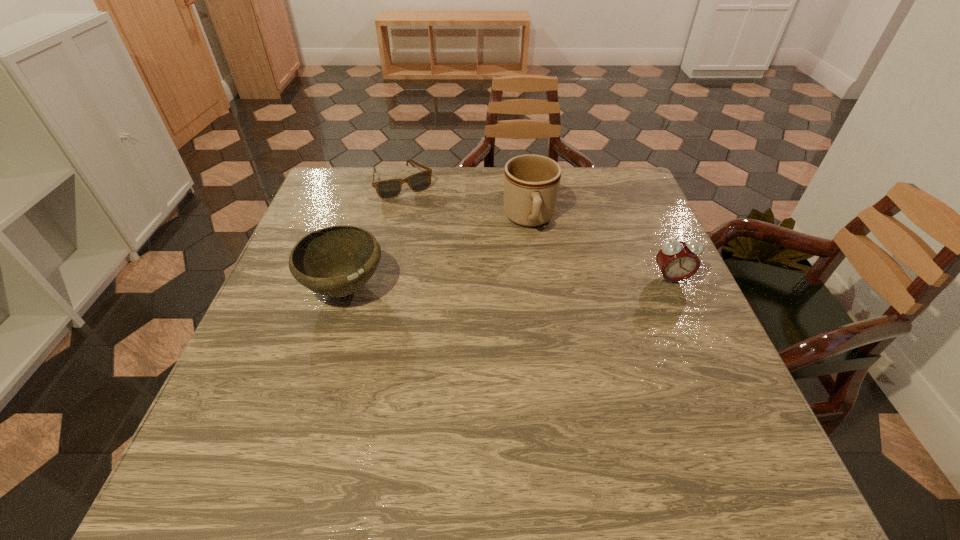
In the image, there is a desktop. Identify the location of vacant space at the left edge. (278, 278).

This screenshot has width=960, height=540. Identify the location of free spot at the right edge of the desktop. (615, 245).

The image size is (960, 540). I want to click on vacant region at the far left corner of the desktop, so click(364, 170).

What are the coordinates of `free location at the near left corner of the desktop` in the screenshot? It's located at (255, 417).

You are a GUI agent. You are given a task and a screenshot of the screen. Output one action in this format:
    pyautogui.click(x=<x>, y=<y>)
    Task: Click on the free space at the far right corner
    This screenshot has height=540, width=960.
    Given the screenshot: What is the action you would take?
    pyautogui.click(x=595, y=166)

What are the coordinates of `blank area at the near right corner` in the screenshot? It's located at (719, 402).

The width and height of the screenshot is (960, 540). I want to click on vacant region between the shortest object and the second object from right to left, so tap(467, 201).

Locate an element on the screen. This screenshot has height=540, width=960. free space that is in between the mug and the rightmost object is located at coordinates (600, 249).

Find the location of a particular element. Image resolution: width=960 pixels, height=540 pixels. free space between the third object from left to right and the rightmost object is located at coordinates (600, 249).

Identify the location of empty space between the shortest object and the alarm clock. This screenshot has height=540, width=960. (538, 231).